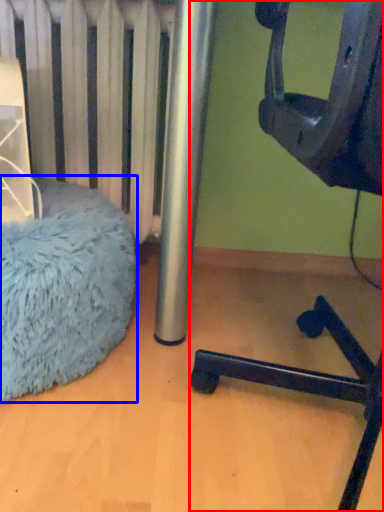
Question: Which point is closer to the camera, furniture (highlighted by a red box) or bean bag chair (highlighted by a blue box)?

Choices:
 (A) furniture
 (B) bean bag chair

Answer: (A)